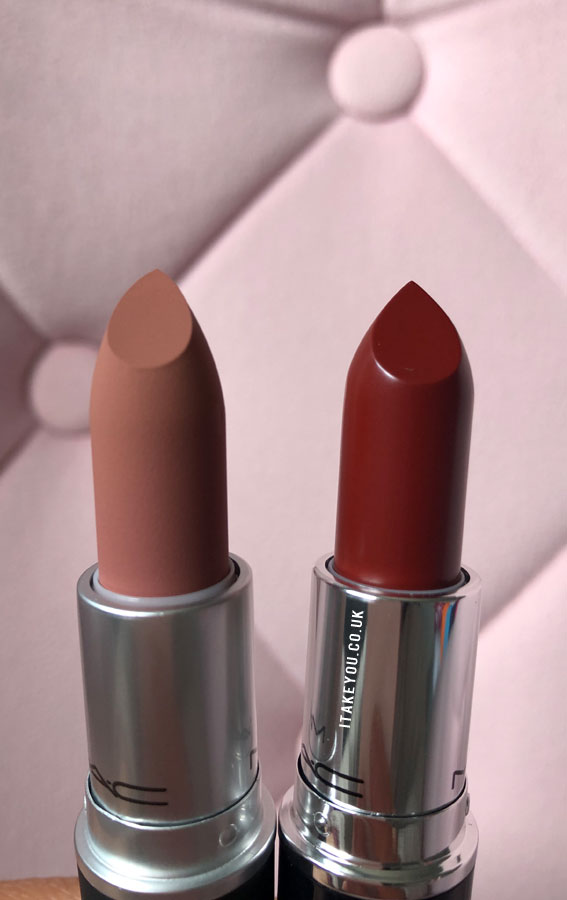
Locate an element on the screen. The image size is (567, 900). sofa circle is located at coordinates (374, 74), (63, 383).